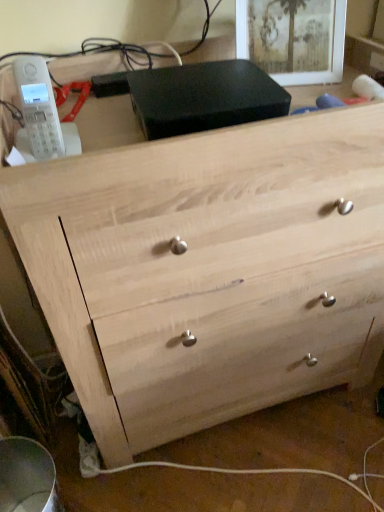
Measure the distance between point (260, 4) and camera.

Point (260, 4) is 89.50 centimeters from camera.

What are the coordinates of `matte black picture frame at upper center` in the screenshot? It's located at coord(327,51).

What do you see at coordinates (327, 51) in the screenshot? The image size is (384, 512). I see `matte black picture frame at upper center` at bounding box center [327, 51].

In order to click on natural wood chest of drawers at center in this screenshot , I will do `click(208, 271)`.

The width and height of the screenshot is (384, 512). Describe the element at coordinates (208, 271) in the screenshot. I see `natural wood chest of drawers at center` at that location.

Identify the location of matte black picture frame at upper center. (327, 51).

Does matte black picture frame at upper center appear on the right side of natural wood chest of drawers at center?

Indeed, matte black picture frame at upper center is positioned on the right side of natural wood chest of drawers at center.

Considering their positions, is matte black picture frame at upper center located in front of or behind natural wood chest of drawers at center?

matte black picture frame at upper center is behind natural wood chest of drawers at center.

Is point (327, 3) positioned behind point (158, 229)?

Yes.

From the image's perspective, is matte black picture frame at upper center positioned above or below natural wood chest of drawers at center?

From the image's perspective, matte black picture frame at upper center appears above natural wood chest of drawers at center.

From a real-world perspective, who is located higher, matte black picture frame at upper center or natural wood chest of drawers at center?

From a 3D spatial view, matte black picture frame at upper center is above.

Is matte black picture frame at upper center thinner than natural wood chest of drawers at center?

Yes.

Which of these two, matte black picture frame at upper center or natural wood chest of drawers at center, stands shorter?

Standing shorter between the two is matte black picture frame at upper center.

Based on their sizes in the image, would you say matte black picture frame at upper center is bigger or smaller than natural wood chest of drawers at center?

matte black picture frame at upper center is smaller than natural wood chest of drawers at center.

Can natural wood chest of drawers at center be found inside matte black picture frame at upper center?

No, natural wood chest of drawers at center is not inside matte black picture frame at upper center.

Are matte black picture frame at upper center and natural wood chest of drawers at center beside each other?

No, matte black picture frame at upper center is not in contact with natural wood chest of drawers at center.

Is natural wood chest of drawers at center at the back of matte black picture frame at upper center?

Yes, matte black picture frame at upper center is facing away from natural wood chest of drawers at center.

How many degrees apart are the facing directions of matte black picture frame at upper center and natural wood chest of drawers at center?

There is a 17.4-degree angle between the facing directions of matte black picture frame at upper center and natural wood chest of drawers at center.

In the scene shown: How much distance is there between matte black picture frame at upper center and natural wood chest of drawers at center?

matte black picture frame at upper center is 19.07 inches from natural wood chest of drawers at center.

This screenshot has width=384, height=512. What are the coordinates of `picture frame located on the right of natural wood chest of drawers at center` in the screenshot? It's located at pos(327,51).

Is natural wood chest of drawers at center at the right side of matte black picture frame at upper center?

No.

Considering their positions, is natural wood chest of drawers at center located in front of or behind matte black picture frame at upper center?

Clearly, natural wood chest of drawers at center is in front of matte black picture frame at upper center.

Is point (337, 362) closer or farther from the camera than point (294, 76)?

Clearly, point (337, 362) is more distant from the camera than point (294, 76).

From the image's perspective, is natural wood chest of drawers at center located above matte black picture frame at upper center?

No, from the image's perspective, natural wood chest of drawers at center is not above matte black picture frame at upper center.

From a real-world perspective, which object rests below the other?

natural wood chest of drawers at center.

Is natural wood chest of drawers at center wider than matte black picture frame at upper center?

Correct, the width of natural wood chest of drawers at center exceeds that of matte black picture frame at upper center.

Looking at this image, does natural wood chest of drawers at center have a lesser height compared to matte black picture frame at upper center?

No, natural wood chest of drawers at center is not shorter than matte black picture frame at upper center.

Considering the relative sizes of natural wood chest of drawers at center and matte black picture frame at upper center in the image provided, is natural wood chest of drawers at center smaller than matte black picture frame at upper center?

Actually, natural wood chest of drawers at center might be larger than matte black picture frame at upper center.

Is natural wood chest of drawers at center inside or outside of matte black picture frame at upper center?

The correct answer is: outside.

Is natural wood chest of drawers at center directly adjacent to matte black picture frame at upper center?

No, natural wood chest of drawers at center is not touching matte black picture frame at upper center.

Is natural wood chest of drawers at center looking in the opposite direction of matte black picture frame at upper center?

No, natural wood chest of drawers at center's orientation is not away from matte black picture frame at upper center.

What's the angular difference between natural wood chest of drawers at center and matte black picture frame at upper center's facing directions?

natural wood chest of drawers at center and matte black picture frame at upper center are facing 17.4 degrees away from each other.

Where is `chest of drawers on the left of the matte black picture frame at upper center`? chest of drawers on the left of the matte black picture frame at upper center is located at coordinates (208, 271).

Find the location of a particular element. This screenshot has width=384, height=512. chest of drawers below the matte black picture frame at upper center (from the image's perspective) is located at coordinates (208, 271).

You are a GUI agent. You are given a task and a screenshot of the screen. Output one action in this format:
    pyautogui.click(x=<x>, y=<y>)
    Task: Click on the picture frame behind the natural wood chest of drawers at center
    Image resolution: width=384 pixels, height=512 pixels.
    Given the screenshot: What is the action you would take?
    pyautogui.click(x=327, y=51)